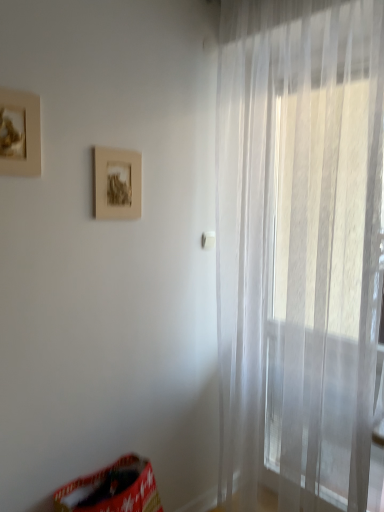
Question: From a real-world perspective, is red fabric bean bag chair at lower left physically above matte gold picture frame at upper left, the second picture frame when ordered from right to left?

Choices:
 (A) yes
 (B) no

Answer: (B)

Question: Can you confirm if red fabric bean bag chair at lower left is wider than matte gold picture frame at upper left, the second picture frame when ordered from right to left?

Choices:
 (A) no
 (B) yes

Answer: (B)

Question: Considering the relative sizes of red fabric bean bag chair at lower left and matte gold picture frame at upper left, which is the 2th picture frame from back to front, in the image provided, is red fabric bean bag chair at lower left smaller than matte gold picture frame at upper left, which is the 2th picture frame from back to front,?

Choices:
 (A) yes
 (B) no

Answer: (B)

Question: Considering the relative positions of red fabric bean bag chair at lower left and matte gold picture frame at upper left, which ranks as the first picture frame in front-to-back order, in the image provided, is red fabric bean bag chair at lower left to the left of matte gold picture frame at upper left, which ranks as the first picture frame in front-to-back order, from the viewer's perspective?

Choices:
 (A) yes
 (B) no

Answer: (B)

Question: Is the position of red fabric bean bag chair at lower left less distant than that of matte gold picture frame at upper left, acting as the 1th picture frame starting from the left?

Choices:
 (A) no
 (B) yes

Answer: (A)

Question: Considering their positions, is red fabric bean bag chair at lower left located in front of or behind matte brown picture frame at center, which is the second picture frame from left to right?

Choices:
 (A) behind
 (B) front

Answer: (B)

Question: Looking at their shapes, would you say red fabric bean bag chair at lower left is wider or thinner than matte brown picture frame at center, the 1th picture frame from the right?

Choices:
 (A) wide
 (B) thin

Answer: (A)

Question: Visually, is red fabric bean bag chair at lower left positioned to the left or to the right of matte brown picture frame at center, the 1th picture frame from the right?

Choices:
 (A) left
 (B) right

Answer: (B)

Question: From a real-world perspective, is red fabric bean bag chair at lower left positioned above or below matte brown picture frame at center, which is the first picture frame from back to front?

Choices:
 (A) above
 (B) below

Answer: (B)

Question: Is transparent fabric curtain at right in front of or behind matte gold picture frame at upper left, the second picture frame when ordered from right to left, in the image?

Choices:
 (A) behind
 (B) front

Answer: (B)

Question: Looking at their shapes, would you say transparent fabric curtain at right is wider or thinner than matte gold picture frame at upper left, acting as the 1th picture frame starting from the left?

Choices:
 (A) wide
 (B) thin

Answer: (A)

Question: Would you say transparent fabric curtain at right is to the left or to the right of matte gold picture frame at upper left, which is the 2th picture frame from back to front, in the picture?

Choices:
 (A) right
 (B) left

Answer: (A)

Question: From the image's perspective, is transparent fabric curtain at right positioned above or below matte gold picture frame at upper left, which is the 2th picture frame from back to front?

Choices:
 (A) above
 (B) below

Answer: (B)

Question: Would you say transparent fabric curtain at right is inside or outside matte brown picture frame at center, which is the second picture frame from front to back?

Choices:
 (A) inside
 (B) outside

Answer: (B)

Question: Is transparent fabric curtain at right bigger or smaller than matte brown picture frame at center, which is the second picture frame from front to back?

Choices:
 (A) small
 (B) big

Answer: (B)